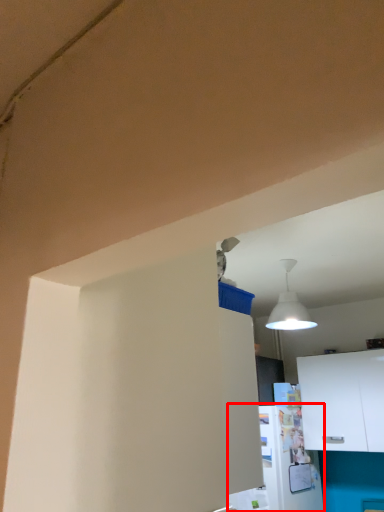
Question: From the image, what is the correct spatial relationship of appliance (annotated by the red box) in relation to cabinetry?

Choices:
 (A) right
 (B) left

Answer: (B)